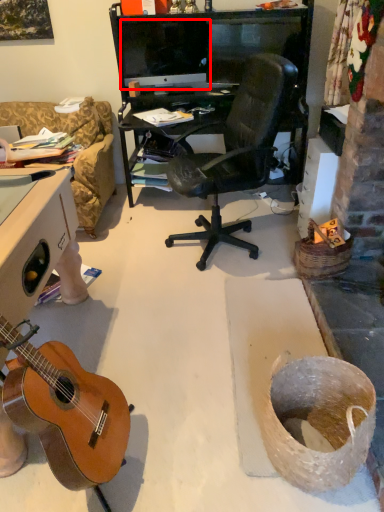
Question: Where is computer monitor (annotated by the red box) located in relation to guitar in the image?

Choices:
 (A) right
 (B) left

Answer: (A)